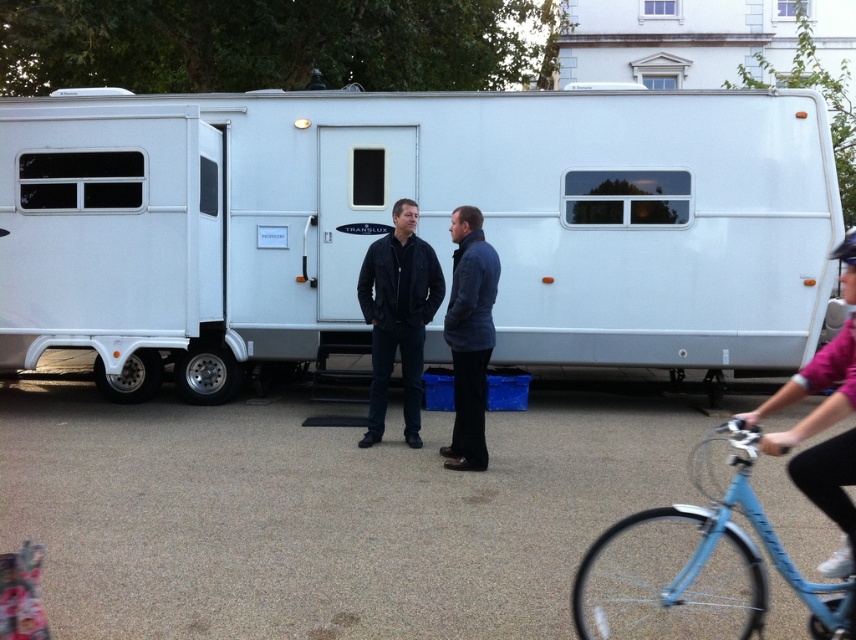
Question: Is white glossy trailer at center thinner than black leather jacket at center?

Choices:
 (A) no
 (B) yes

Answer: (A)

Question: Which point is closer to the camera taking this photo?

Choices:
 (A) (848, 244)
 (B) (415, 440)

Answer: (A)

Question: Which is farther from the blue matte bicycle at lower right?

Choices:
 (A) matte black helmet at upper right
 (B) black leather jacket at center

Answer: (B)

Question: Does blue matte bicycle at lower right appear under pink fabric helmet at upper right?

Choices:
 (A) yes
 (B) no

Answer: (A)

Question: Which object is the farthest from the white glossy trailer at center?

Choices:
 (A) black leather jacket at center
 (B) pink fabric helmet at upper right
 (C) blue matte bicycle at lower right
 (D) dark blue quilted jacket at center

Answer: (B)

Question: Can you confirm if pink fabric helmet at upper right is thinner than matte black helmet at upper right?

Choices:
 (A) yes
 (B) no

Answer: (A)